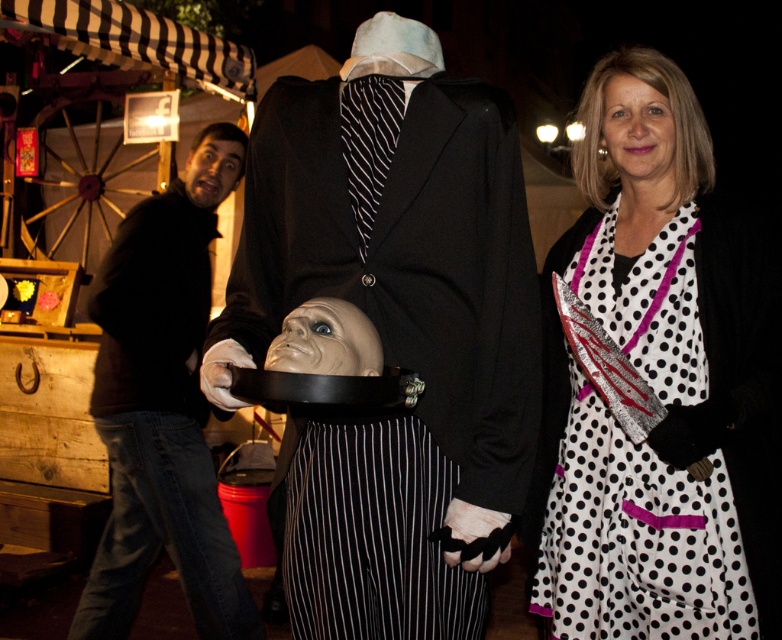
Question: Is dark brown leather jacket at left bigger than smooth plastic mask at center?

Choices:
 (A) yes
 (B) no

Answer: (A)

Question: Among these points, which one is farthest from the camera?

Choices:
 (A) (590, 492)
 (B) (224, 189)

Answer: (B)

Question: Does matte black suit at center appear on the left side of smooth skin face at upper right?

Choices:
 (A) no
 (B) yes

Answer: (B)

Question: Observing the image, what is the correct spatial positioning of smooth skin face at upper right in reference to smooth skin face at upper left?

Choices:
 (A) left
 (B) right

Answer: (B)

Question: Among these points, which one is farthest from the camera?

Choices:
 (A) (375, 360)
 (B) (400, 179)
 (C) (224, 173)
 (D) (615, 433)

Answer: (C)

Question: Which point is farther to the camera?

Choices:
 (A) smooth skin face at upper right
 (B) smooth plastic mask at center
 (C) smooth skin face at upper left
 (D) dark brown leather jacket at left

Answer: (C)